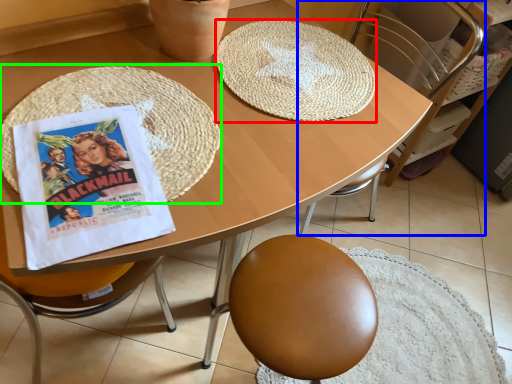
Question: Which object is the farthest from mat (highlighted by a red box)? Choose among these: chair (highlighted by a blue box) or mat (highlighted by a green box).

Choices:
 (A) chair
 (B) mat

Answer: (A)